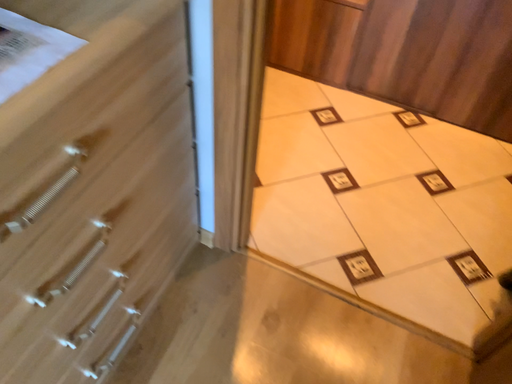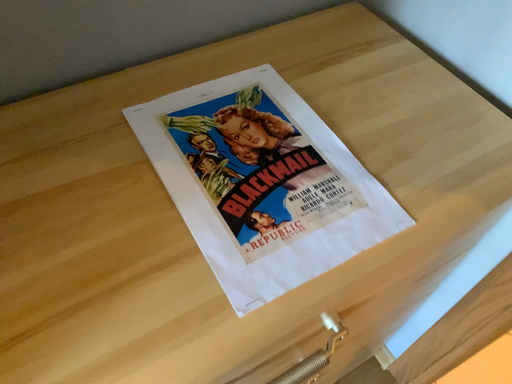
Question: Which way did the camera rotate in the video?

Choices:
 (A) rotated right
 (B) rotated left

Answer: (B)